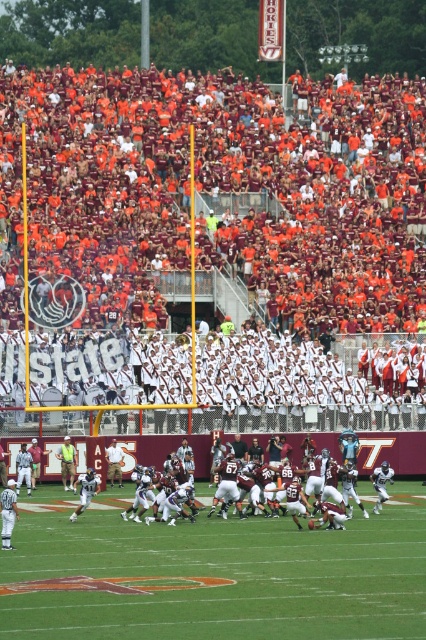
Question: Which object is farther from the camera taking this photo?

Choices:
 (A) maroon fabric seats at upper center
 (B) green grass football field at center

Answer: (A)

Question: Can you confirm if maroon fabric seats at upper center is positioned to the left of green grass football field at center?

Choices:
 (A) yes
 (B) no

Answer: (A)

Question: Observing the image, what is the correct spatial positioning of maroon fabric seats at upper center in reference to maroon uniformed players at center?

Choices:
 (A) above
 (B) below

Answer: (A)

Question: Which point appears farthest from the camera in this image?

Choices:
 (A) (146, 545)
 (B) (336, 435)

Answer: (B)

Question: In this image, where is green grass football field at center located relative to maroon uniformed players at center?

Choices:
 (A) right
 (B) left

Answer: (B)

Question: Considering the real-world distances, which object is closest to the maroon uniformed players at center?

Choices:
 (A) green grass football field at center
 (B) maroon fabric seats at upper center

Answer: (A)